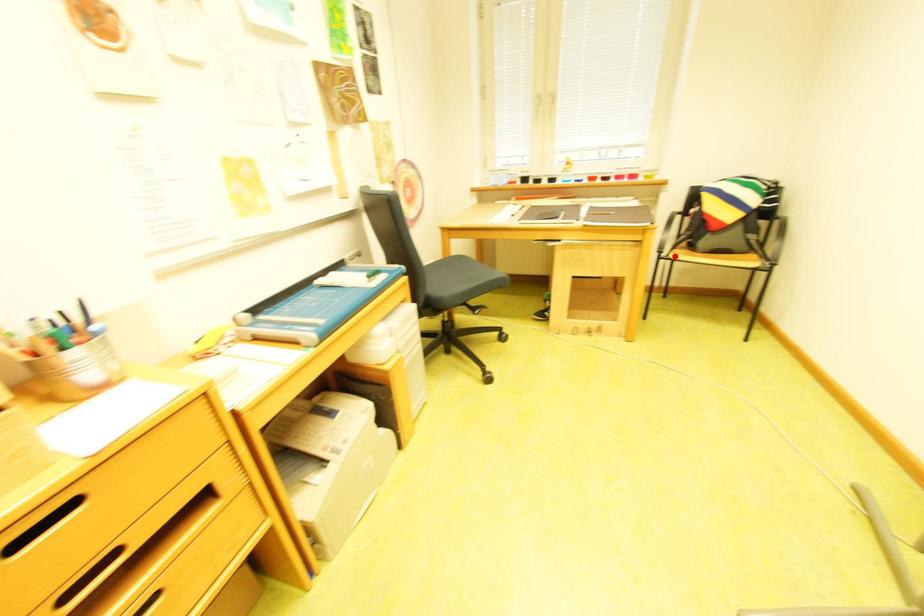
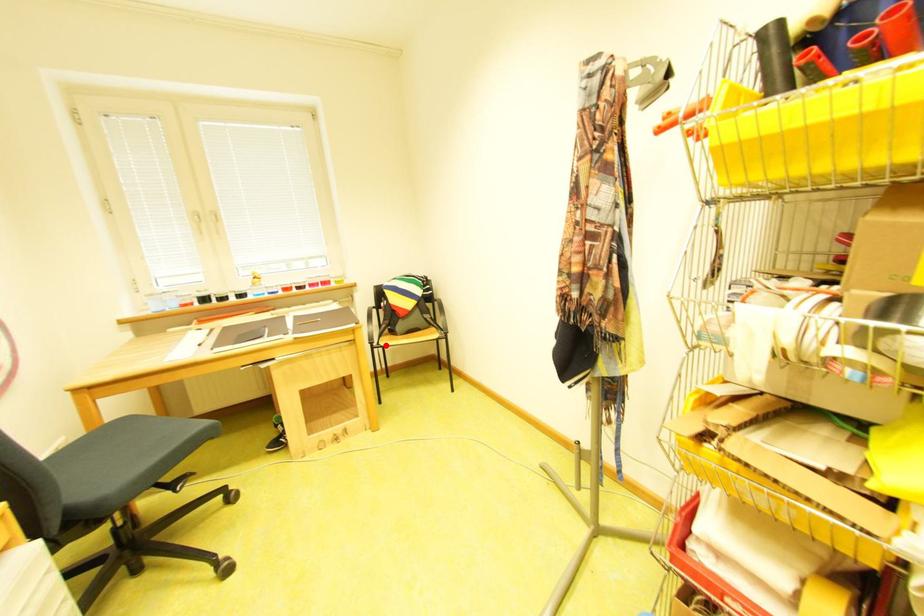
I am providing you with two images of the same scene from different viewpoints. A red point is marked on the first image and another point is marked on the second image. Are the points marked in image1 and image2 representing the same 3D position?

Yes